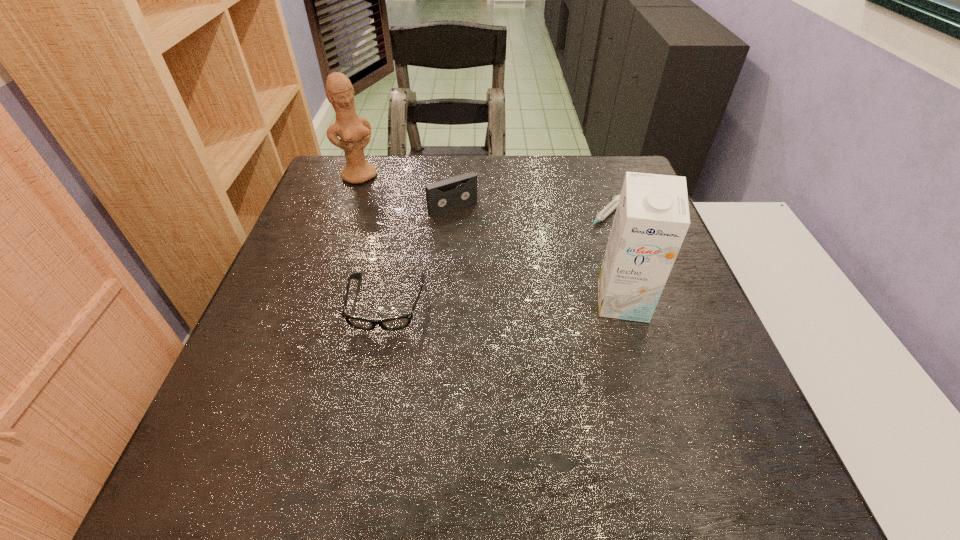
At what (x,y) coordinates should I click in order to perform the action: click on the second closest object to the carton. Please return your answer as a coordinate pair (x, y). Looking at the image, I should click on pyautogui.click(x=442, y=196).

Identify the location of object that stands as the fourth closest to the spectacles. Image resolution: width=960 pixels, height=540 pixels. (613, 204).

At what (x,y) coordinates should I click in order to perform the action: click on free region that satisfies the following two spatial constraints: 1. on the front side of the third shortest object; 2. on the right side of the shortest object. Please return your answer as a coordinate pair (x, y). Looking at the image, I should click on (452, 216).

In order to click on vacant space that satisfies the following two spatial constraints: 1. on the front side of the figurine; 2. on the right side of the videotape in this screenshot , I will do `click(348, 207)`.